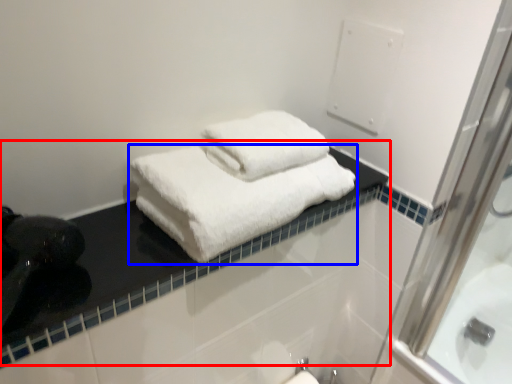
Question: Which object is closer to the camera taking this photo, counter top (highlighted by a red box) or towel (highlighted by a blue box)?

Choices:
 (A) counter top
 (B) towel

Answer: (A)